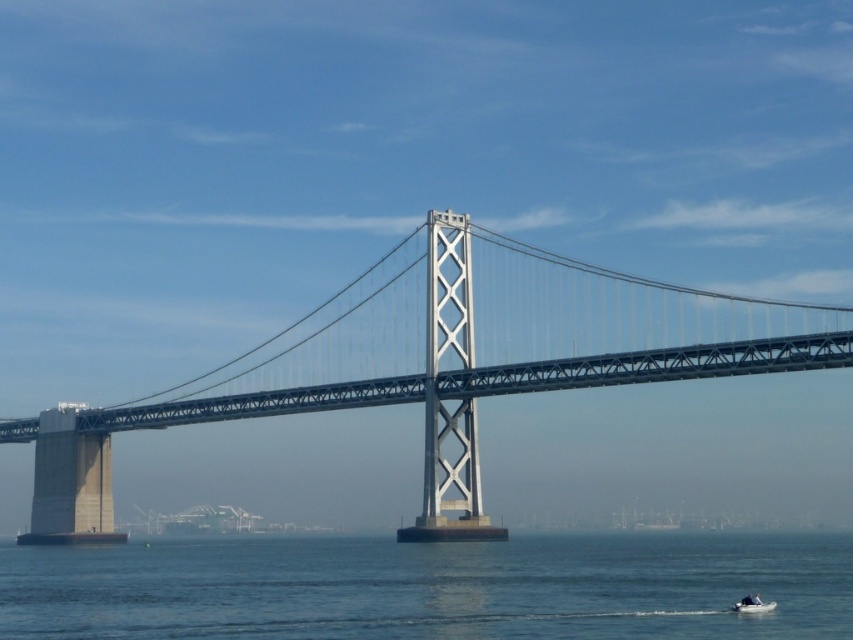
Is metallic gray bridge at center taller than white plastic boat at lower right?

Yes, metallic gray bridge at center is taller than white plastic boat at lower right.

Where is `metallic gray bridge at center`? This screenshot has width=853, height=640. metallic gray bridge at center is located at coordinates (x=439, y=364).

Does point (271, 616) come in front of point (759, 609)?

No.

You are a GUI agent. You are given a task and a screenshot of the screen. Output one action in this format:
    pyautogui.click(x=<x>, y=<y>)
    Task: Click on the blue water at lower center
    
    Given the screenshot: What is the action you would take?
    pyautogui.click(x=430, y=588)

Which of these two, metallic gray bridge at center or blue water at lower center, stands shorter?

Standing shorter between the two is blue water at lower center.

Locate an element on the screen. Image resolution: width=853 pixels, height=640 pixels. metallic gray bridge at center is located at coordinates (439, 364).